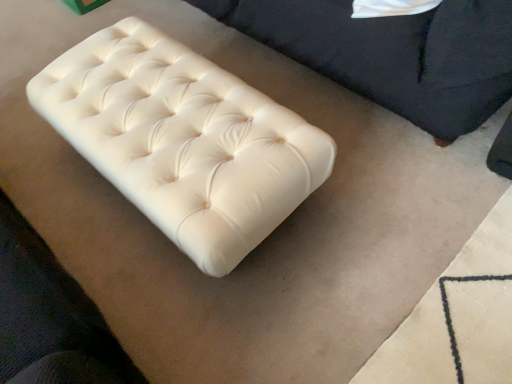
Consider the image. What is the approximate width of white leather ottoman at upper right, which is the first furniture in right-to-left order?

The width of white leather ottoman at upper right, which is the first furniture in right-to-left order, is 57.73 centimeters.

The height and width of the screenshot is (384, 512). What do you see at coordinates (394, 54) in the screenshot?
I see `white leather ottoman at upper right, the 2th furniture from the left` at bounding box center [394, 54].

Identify the location of white leather ottoman at upper right, the 2th furniture from the left. Image resolution: width=512 pixels, height=384 pixels. (394, 54).

How much space does white leather ottoman at upper right, which is the first furniture in right-to-left order, occupy vertically?

It is 45.89 centimeters.

In order to face white leather ottoman at center, which appears as the 2th furniture when viewed from the right, should I rotate leftwards or rightwards?

To align with it, rotate left about 11.110°.

What do you see at coordinates (183, 140) in the screenshot?
I see `white leather ottoman at center, which appears as the 2th furniture when viewed from the right` at bounding box center [183, 140].

At what (x,y) coordinates should I click in order to perform the action: click on white leather ottoman at center, marked as the 1th furniture in a left-to-right arrangement. Please return your answer as a coordinate pair (x, y). The image size is (512, 384). Looking at the image, I should click on (183, 140).

This screenshot has height=384, width=512. Identify the location of white leather ottoman at upper right, which is the first furniture in right-to-left order. (394, 54).

Between white leather ottoman at upper right, the 2th furniture from the left, and white leather ottoman at center, marked as the 1th furniture in a left-to-right arrangement, which one appears on the left side from the viewer's perspective?

white leather ottoman at center, marked as the 1th furniture in a left-to-right arrangement, is more to the left.

In the image, is white leather ottoman at upper right, which is the first furniture in right-to-left order, positioned in front of or behind white leather ottoman at center, marked as the 1th furniture in a left-to-right arrangement?

white leather ottoman at upper right, which is the first furniture in right-to-left order, is positioned closer to the viewer than white leather ottoman at center, marked as the 1th furniture in a left-to-right arrangement.

Which point is more distant from viewer, [439,115] or [289,188]?

The point [439,115] is farther.

From the image's perspective, is white leather ottoman at upper right, which is the first furniture in right-to-left order, on white leather ottoman at center, which appears as the 2th furniture when viewed from the right?

Yes.

From a real-world perspective, is white leather ottoman at upper right, the 2th furniture from the left, physically located above or below white leather ottoman at center, which appears as the 2th furniture when viewed from the right?

white leather ottoman at upper right, the 2th furniture from the left, is above white leather ottoman at center, which appears as the 2th furniture when viewed from the right.

Does white leather ottoman at upper right, the 2th furniture from the left, have a lesser width compared to white leather ottoman at center, marked as the 1th furniture in a left-to-right arrangement?

Yes, white leather ottoman at upper right, the 2th furniture from the left, is thinner than white leather ottoman at center, marked as the 1th furniture in a left-to-right arrangement.

Considering the relative sizes of white leather ottoman at upper right, which is the first furniture in right-to-left order, and white leather ottoman at center, which appears as the 2th furniture when viewed from the right, in the image provided, is white leather ottoman at upper right, which is the first furniture in right-to-left order, taller than white leather ottoman at center, which appears as the 2th furniture when viewed from the right,?

Correct, white leather ottoman at upper right, which is the first furniture in right-to-left order, is much taller as white leather ottoman at center, which appears as the 2th furniture when viewed from the right.

Is white leather ottoman at upper right, the 2th furniture from the left, smaller than white leather ottoman at center, marked as the 1th furniture in a left-to-right arrangement?

Correct, white leather ottoman at upper right, the 2th furniture from the left, occupies less space than white leather ottoman at center, marked as the 1th furniture in a left-to-right arrangement.

Is white leather ottoman at upper right, the 2th furniture from the left, not inside white leather ottoman at center, which appears as the 2th furniture when viewed from the right?

white leather ottoman at upper right, the 2th furniture from the left, lies outside white leather ottoman at center, which appears as the 2th furniture when viewed from the right,'s area.

Are white leather ottoman at upper right, the 2th furniture from the left, and white leather ottoman at center, marked as the 1th furniture in a left-to-right arrangement, beside each other?

white leather ottoman at upper right, the 2th furniture from the left, and white leather ottoman at center, marked as the 1th furniture in a left-to-right arrangement, are not in contact.

Could you tell me if white leather ottoman at upper right, which is the first furniture in right-to-left order, is facing white leather ottoman at center, marked as the 1th furniture in a left-to-right arrangement?

No, white leather ottoman at upper right, which is the first furniture in right-to-left order, is not facing towards white leather ottoman at center, marked as the 1th furniture in a left-to-right arrangement.

What's the angular difference between white leather ottoman at upper right, the 2th furniture from the left, and white leather ottoman at center, marked as the 1th furniture in a left-to-right arrangement,'s facing directions?

They differ by 14.1 degrees in their facing directions.

Image resolution: width=512 pixels, height=384 pixels. Identify the location of furniture that is behind the white leather ottoman at upper right, which is the first furniture in right-to-left order. (183, 140).

Considering the positions of objects white leather ottoman at center, marked as the 1th furniture in a left-to-right arrangement, and white leather ottoman at upper right, the 2th furniture from the left, in the image provided, who is more to the right, white leather ottoman at center, marked as the 1th furniture in a left-to-right arrangement, or white leather ottoman at upper right, the 2th furniture from the left,?

From the viewer's perspective, white leather ottoman at upper right, the 2th furniture from the left, appears more on the right side.

In the image, is white leather ottoman at center, marked as the 1th furniture in a left-to-right arrangement, positioned in front of or behind white leather ottoman at upper right, which is the first furniture in right-to-left order?

In the image, white leather ottoman at center, marked as the 1th furniture in a left-to-right arrangement, appears behind white leather ottoman at upper right, which is the first furniture in right-to-left order.

Is point (250, 238) closer to camera compared to point (431, 47)?

That is True.

From the image's perspective, is white leather ottoman at center, marked as the 1th furniture in a left-to-right arrangement, on white leather ottoman at upper right, which is the first furniture in right-to-left order?

No, from the image's perspective, white leather ottoman at center, marked as the 1th furniture in a left-to-right arrangement, is not above white leather ottoman at upper right, which is the first furniture in right-to-left order.

From a real-world perspective, which object stands above the other?

From a 3D spatial view, white leather ottoman at upper right, which is the first furniture in right-to-left order, is above.

In terms of width, does white leather ottoman at center, which appears as the 2th furniture when viewed from the right, look wider or thinner when compared to white leather ottoman at upper right, the 2th furniture from the left?

white leather ottoman at center, which appears as the 2th furniture when viewed from the right, is wider than white leather ottoman at upper right, the 2th furniture from the left.

Can you confirm if white leather ottoman at center, marked as the 1th furniture in a left-to-right arrangement, is taller than white leather ottoman at upper right, which is the first furniture in right-to-left order?

No, white leather ottoman at center, marked as the 1th furniture in a left-to-right arrangement, is not taller than white leather ottoman at upper right, which is the first furniture in right-to-left order.

Considering the sizes of white leather ottoman at center, marked as the 1th furniture in a left-to-right arrangement, and white leather ottoman at upper right, which is the first furniture in right-to-left order, in the image, is white leather ottoman at center, marked as the 1th furniture in a left-to-right arrangement, bigger or smaller than white leather ottoman at upper right, which is the first furniture in right-to-left order,?

white leather ottoman at center, marked as the 1th furniture in a left-to-right arrangement, is bigger than white leather ottoman at upper right, which is the first furniture in right-to-left order.

Is white leather ottoman at center, marked as the 1th furniture in a left-to-right arrangement, positioned beyond the bounds of white leather ottoman at upper right, which is the first furniture in right-to-left order?

white leather ottoman at center, marked as the 1th furniture in a left-to-right arrangement, lies outside white leather ottoman at upper right, which is the first furniture in right-to-left order,'s area.

Is white leather ottoman at center, marked as the 1th furniture in a left-to-right arrangement, next to white leather ottoman at upper right, which is the first furniture in right-to-left order, and touching it?

No, white leather ottoman at center, marked as the 1th furniture in a left-to-right arrangement, is not in contact with white leather ottoman at upper right, which is the first furniture in right-to-left order.

Is white leather ottoman at upper right, the 2th furniture from the left, at the back of white leather ottoman at center, marked as the 1th furniture in a left-to-right arrangement?

That's not correct — white leather ottoman at center, marked as the 1th furniture in a left-to-right arrangement, is not looking away from white leather ottoman at upper right, the 2th furniture from the left.

Measure the distance between white leather ottoman at center, marked as the 1th furniture in a left-to-right arrangement, and white leather ottoman at upper right, which is the first furniture in right-to-left order.

19.47 inches.

Where is `furniture in front of the white leather ottoman at center, which appears as the 2th furniture when viewed from the right`? The width and height of the screenshot is (512, 384). furniture in front of the white leather ottoman at center, which appears as the 2th furniture when viewed from the right is located at coordinates (394, 54).

Image resolution: width=512 pixels, height=384 pixels. Find the location of `furniture located on the right of white leather ottoman at center, which appears as the 2th furniture when viewed from the right`. furniture located on the right of white leather ottoman at center, which appears as the 2th furniture when viewed from the right is located at coordinates (394, 54).

What are the coordinates of `furniture lying behind the white leather ottoman at upper right, which is the first furniture in right-to-left order` in the screenshot? It's located at (183, 140).